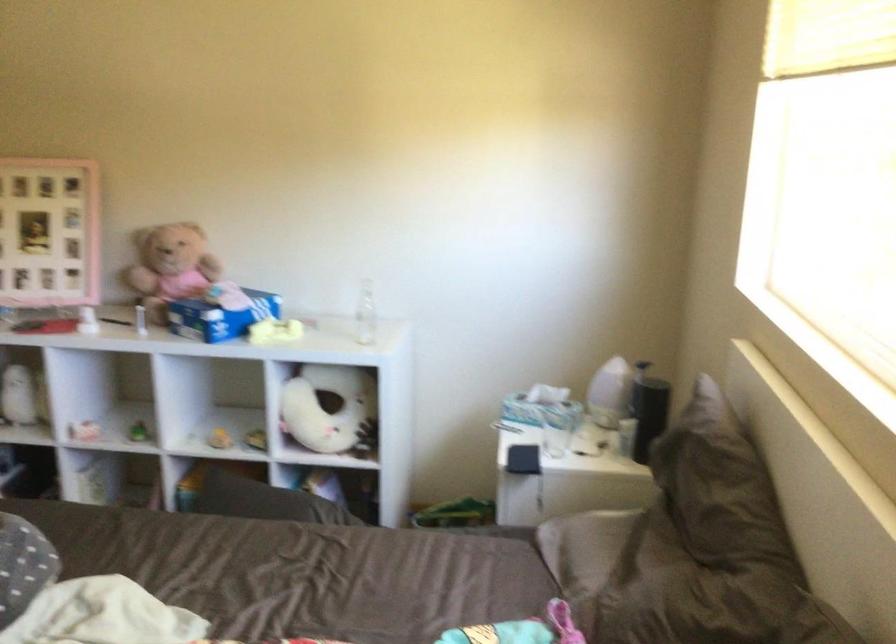
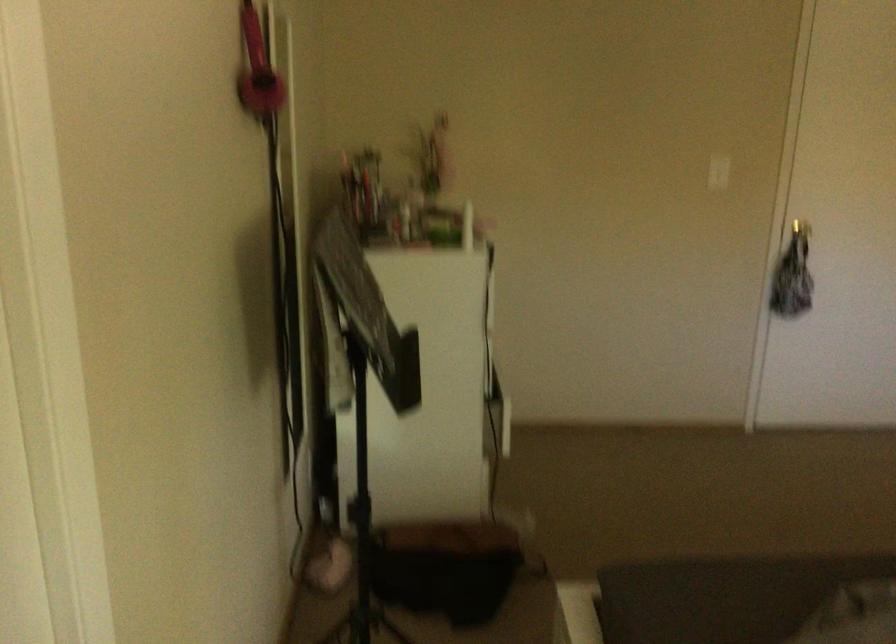
Question: How did the camera likely rotate?

Choices:
 (A) Left
 (B) Right
 (C) Up
 (D) Down

Answer: (A)